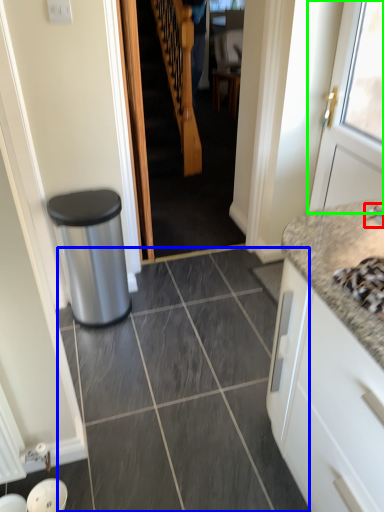
Question: Estimate the real-world distances between objects in this image. Which object is farther from faucet (highlighted by a red box), granite (highlighted by a blue box) or door (highlighted by a green box)?

Choices:
 (A) granite
 (B) door

Answer: (A)